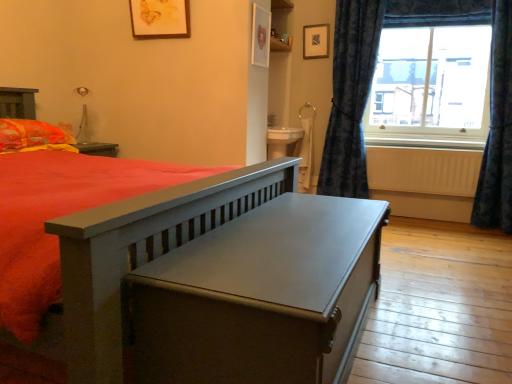
At what (x,y) coordinates should I click in order to perform the action: click on vacant region above white painted wood at right (from a real-world perspective). Please return your answer as a coordinate pair (x, y). Looking at the image, I should click on (418, 135).